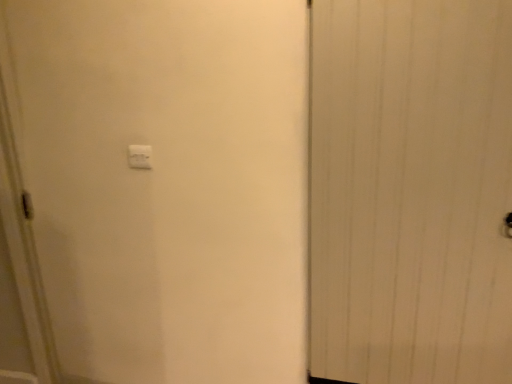
Question: Does white plastic light switch at upper center have a larger size compared to white wood door at right?

Choices:
 (A) no
 (B) yes

Answer: (A)

Question: Is white plastic light switch at upper center located outside white wood door at right?

Choices:
 (A) no
 (B) yes

Answer: (B)

Question: Does white plastic light switch at upper center appear on the right side of white wood door at right?

Choices:
 (A) yes
 (B) no

Answer: (B)

Question: Would you say white plastic light switch at upper center contains white wood door at right?

Choices:
 (A) yes
 (B) no

Answer: (B)

Question: Is the depth of white plastic light switch at upper center greater than that of white wood door at right?

Choices:
 (A) no
 (B) yes

Answer: (B)

Question: From a real-world perspective, is white plastic light switch at upper center under white wood door at right?

Choices:
 (A) yes
 (B) no

Answer: (B)

Question: Is the depth of white wood door at right less than that of white plastic light switch at upper center?

Choices:
 (A) yes
 (B) no

Answer: (A)

Question: From the image's perspective, would you say white wood door at right is shown under white plastic light switch at upper center?

Choices:
 (A) yes
 (B) no

Answer: (A)

Question: From a real-world perspective, is white wood door at right on top of white plastic light switch at upper center?

Choices:
 (A) yes
 (B) no

Answer: (B)

Question: Can you confirm if white wood door at right is positioned to the right of white plastic light switch at upper center?

Choices:
 (A) no
 (B) yes

Answer: (B)

Question: Considering the relative positions of white wood door at right and white plastic light switch at upper center in the image provided, is white wood door at right behind white plastic light switch at upper center?

Choices:
 (A) no
 (B) yes

Answer: (A)

Question: Can you confirm if white wood door at right is wider than white plastic light switch at upper center?

Choices:
 (A) no
 (B) yes

Answer: (B)

Question: From a real-world perspective, is white plastic light switch at upper center above or below white wood door at right?

Choices:
 (A) below
 (B) above

Answer: (B)